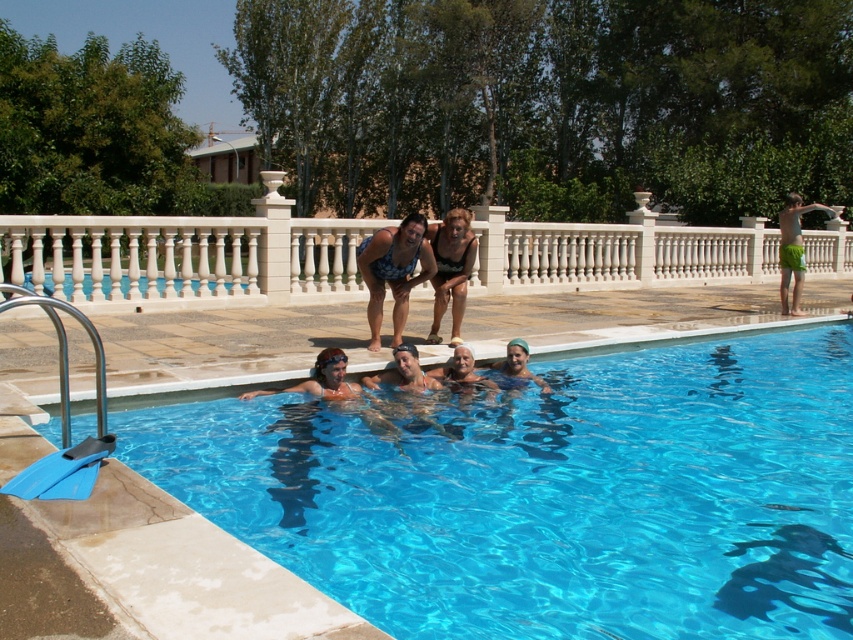
Between transparent blue water at center and blue swimsuit at upper center, which one appears on the left side from the viewer's perspective?

Positioned to the left is blue swimsuit at upper center.

Find the location of a particular element. transparent blue water at center is located at coordinates (552, 496).

The height and width of the screenshot is (640, 853). I want to click on transparent blue water at center, so click(x=552, y=496).

Which is in front, point (782, 273) or point (328, 362)?

Point (328, 362) is in front.

Is green fabric shorts at right closer to camera compared to clear plastic goggles at upper center?

No.

The width and height of the screenshot is (853, 640). Identify the location of green fabric shorts at right. (793, 248).

The width and height of the screenshot is (853, 640). Identify the location of matte black swimsuit at center. (450, 268).

Is point (448, 275) in front of point (801, 253)?

Yes, it is in front of point (801, 253).

The height and width of the screenshot is (640, 853). I want to click on matte black swimsuit at center, so click(x=450, y=268).